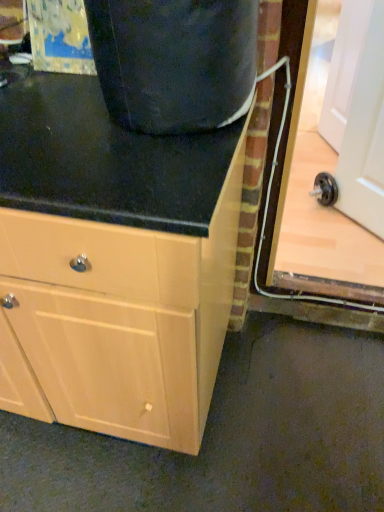
Find the location of a particular element. free space above light wood cabinet at center (from a real-world perspective) is located at coordinates coord(74,130).